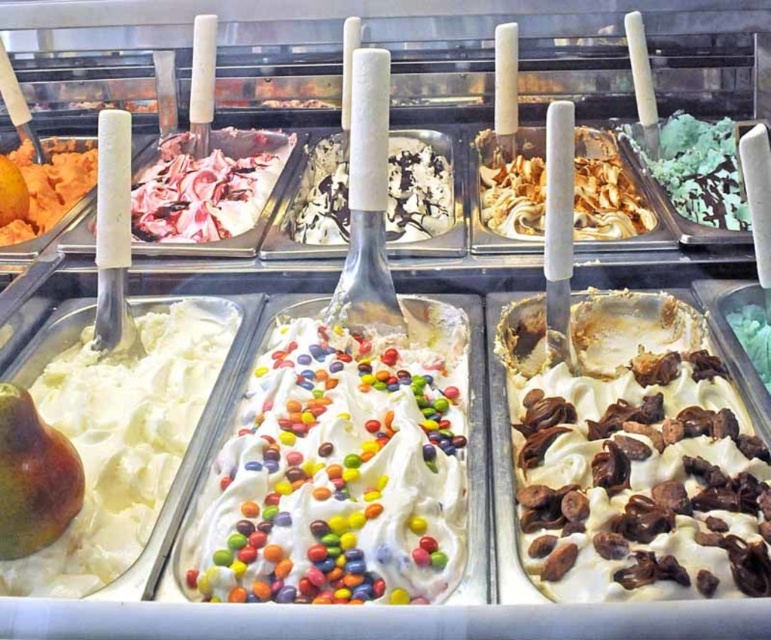
Does whipped cream with chocolate chips at center have a smaller size compared to white creamy ice cream at left?

Incorrect, whipped cream with chocolate chips at center is not smaller in size than white creamy ice cream at left.

Measure the distance between point (743, 582) and camera.

They are 32.57 inches apart.

Between point (702, 410) and point (79, 445), which one is positioned in front?

Point (79, 445)

Where is `whipped cream with chocolate chips at center`? The image size is (771, 640). whipped cream with chocolate chips at center is located at coordinates (631, 456).

Is point (295, 556) farther from camera compared to point (41, 548)?

That is False.

Can you confirm if white creamy ice cream with colorful candies at center is taller than white creamy ice cream at left?

In fact, white creamy ice cream with colorful candies at center may be shorter than white creamy ice cream at left.

Which is behind, point (450, 358) or point (51, 385)?

The point (450, 358) is behind.

You are a GUI agent. You are given a task and a screenshot of the screen. Output one action in this format:
    pyautogui.click(x=<x>, y=<y>)
    Task: Click on the white creamy ice cream with colorful candies at center
    
    Given the screenshot: What is the action you would take?
    pyautogui.click(x=335, y=476)

From the picture: Measure the distance between whipped cream with chocolate chips at center and camera.

whipped cream with chocolate chips at center is 31.92 inches from camera.

Does point (519, 477) come closer to viewer compared to point (335, 522)?

No, (519, 477) is further to viewer.

Does point (705, 406) come behind point (315, 436)?

Yes, point (705, 406) is farther from viewer.

Locate an element on the screen. whipped cream with chocolate chips at center is located at coordinates (631, 456).